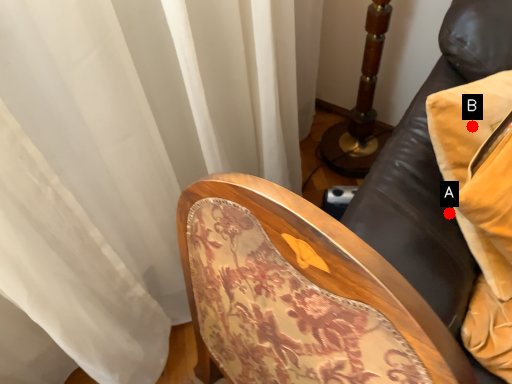
Question: Two points are circled on the image, labeled by A and B beside each circle. Which of the following is the farthest from the observer?

Choices:
 (A) A is further
 (B) B is further

Answer: (A)